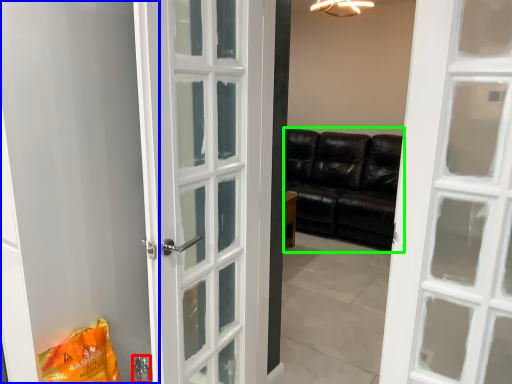
Question: Estimate the real-world distances between objects in this image. Which object is farther from door handle (highlighted by a red box), screen door (highlighted by a blue box) or studio couch (highlighted by a green box)?

Choices:
 (A) screen door
 (B) studio couch

Answer: (B)